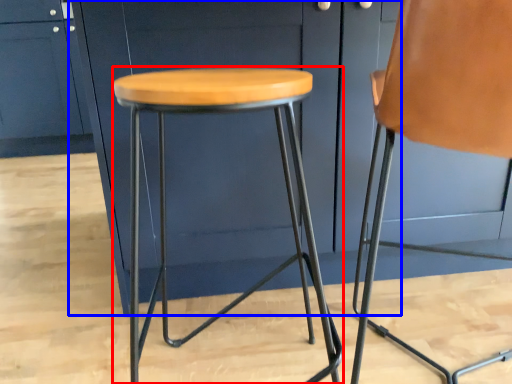
Question: Among these objects, which one is farthest to the camera, stool (highlighted by a red box) or cabinetry (highlighted by a blue box)?

Choices:
 (A) stool
 (B) cabinetry

Answer: (B)